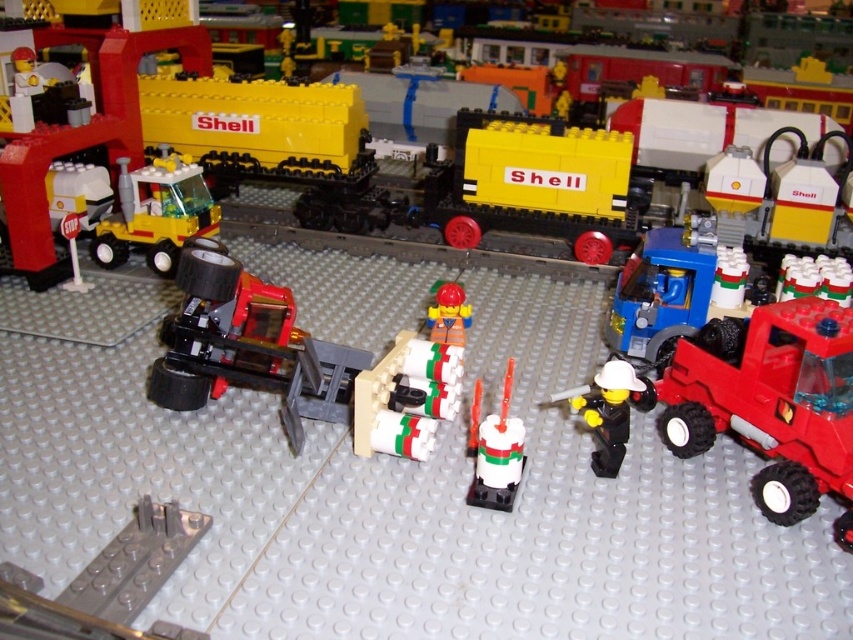
Question: Which object is the farthest from the black matte figure at center?

Choices:
 (A) rubberized red truck at right
 (B) smooth plastic construction worker at center
 (C) white glossy candle at center
 (D) matte yellow truck at left

Answer: (D)

Question: Is rubberized red truck at right below black matte figure at center?

Choices:
 (A) yes
 (B) no

Answer: (B)

Question: Does rubberized red truck at right have a lesser width compared to black matte figure at center?

Choices:
 (A) yes
 (B) no

Answer: (B)

Question: Does rubberized red truck at right lie behind matte yellow truck at left?

Choices:
 (A) no
 (B) yes

Answer: (A)

Question: Estimate the real-world distances between objects in this image. Which object is closer to the white glossy candle at center?

Choices:
 (A) matte yellow truck at left
 (B) rubberized red truck at right

Answer: (B)

Question: Among these points, which one is nearest to the camera?

Choices:
 (A) (161, 269)
 (B) (486, 461)

Answer: (B)